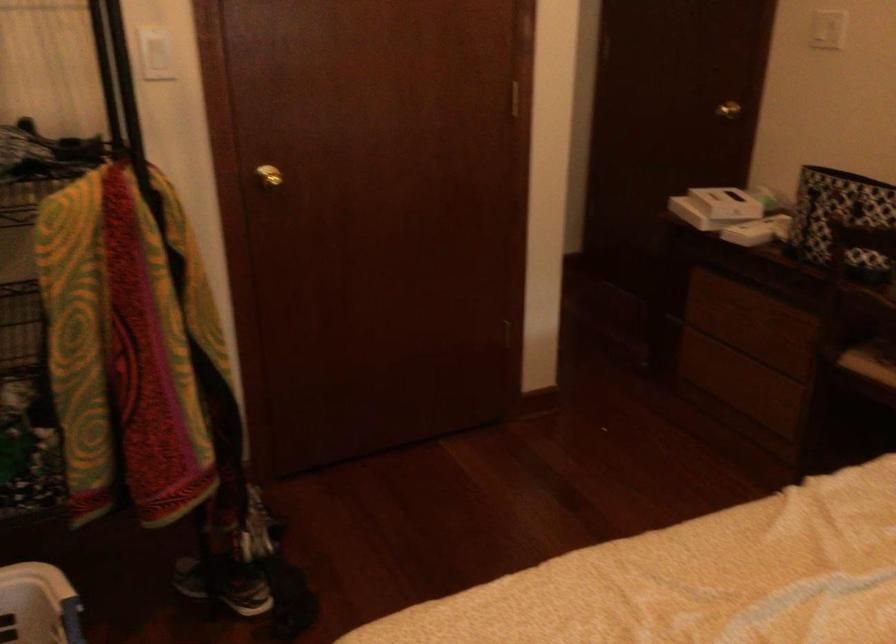
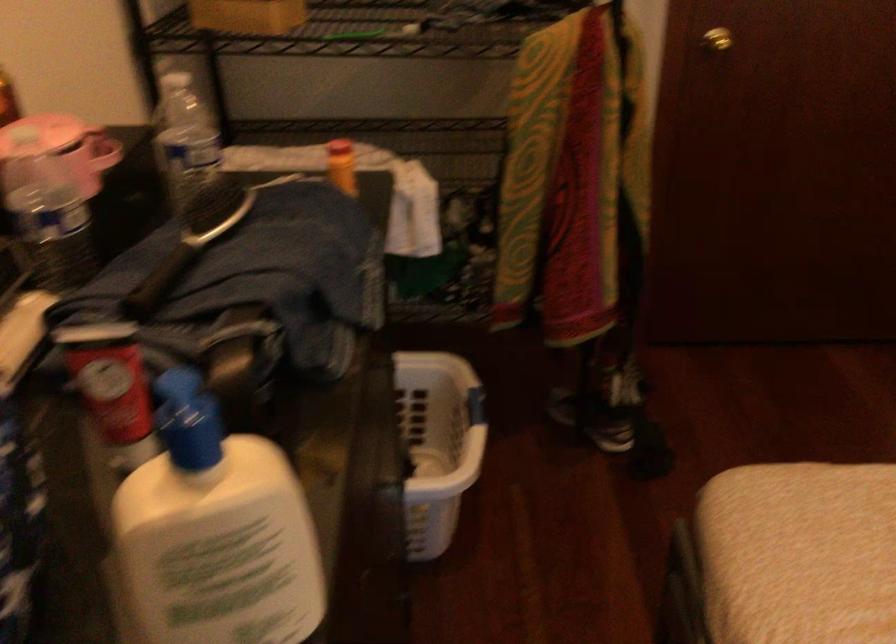
Question: The camera is either moving clockwise (left) or counter-clockwise (right) around the object. The first image is from the beginning of the video and the second image is from the end. Is the camera moving left or right when shooting the video?

Choices:
 (A) Left
 (B) Right

Answer: (B)